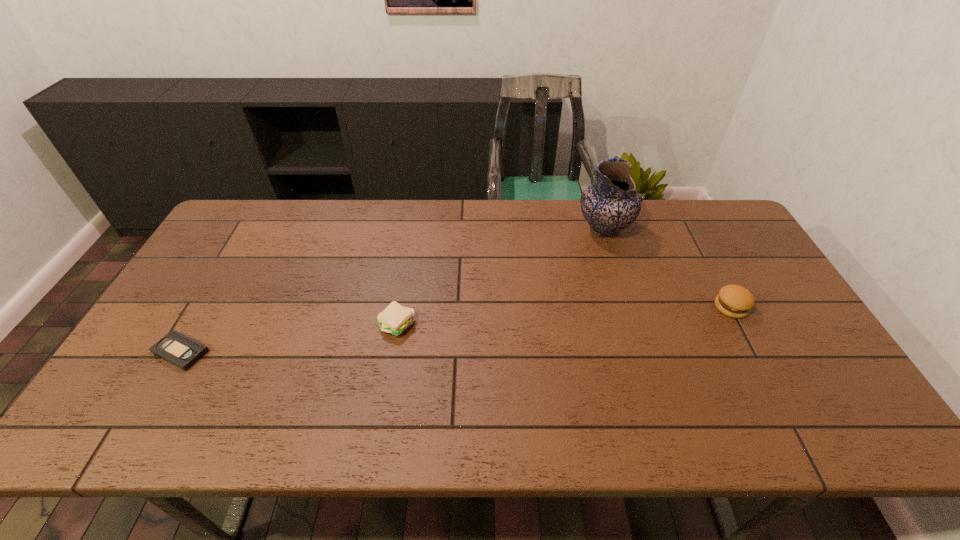
Image resolution: width=960 pixels, height=540 pixels. I want to click on pottery, so click(611, 204).

Where is `the third object from left to right`? the third object from left to right is located at coordinates (611, 204).

Where is `the third shortest object`? The height and width of the screenshot is (540, 960). the third shortest object is located at coordinates (735, 301).

Locate an element on the screen. the rightmost object is located at coordinates (735, 301).

You are a GUI agent. You are given a task and a screenshot of the screen. Output one action in this format:
    pyautogui.click(x=<x>, y=<y>)
    Task: Click on the patty
    Image resolution: width=960 pixels, height=540 pixels.
    Given the screenshot: What is the action you would take?
    pyautogui.click(x=395, y=319)

This screenshot has width=960, height=540. Find the location of `the second object from left to right`. the second object from left to right is located at coordinates (395, 319).

Where is `the leftmost object`? The width and height of the screenshot is (960, 540). the leftmost object is located at coordinates (183, 352).

This screenshot has height=540, width=960. Find the location of `videotape`. videotape is located at coordinates (183, 352).

At what (x,y) coordinates should I click in order to perform the action: click on vacant space located 0.170m on the front of the pottery. Please return your answer as a coordinate pair (x, y). Image resolution: width=960 pixels, height=540 pixels. Looking at the image, I should click on (622, 286).

Where is `free location located on the back of the second tallest object`? free location located on the back of the second tallest object is located at coordinates (713, 273).